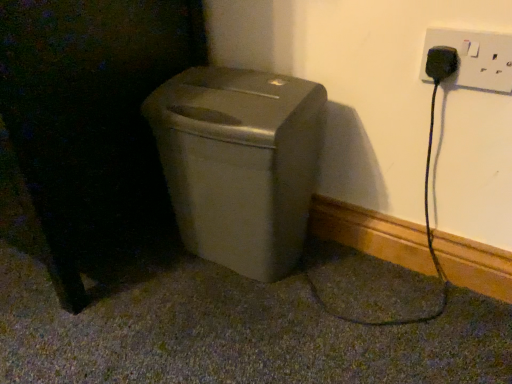
Image resolution: width=512 pixels, height=384 pixels. What do you see at coordinates (240, 163) in the screenshot? I see `satin beige trash can at center` at bounding box center [240, 163].

Image resolution: width=512 pixels, height=384 pixels. What do you see at coordinates (474, 58) in the screenshot?
I see `white plastic plug at upper right` at bounding box center [474, 58].

The width and height of the screenshot is (512, 384). I want to click on satin beige trash can at center, so click(x=240, y=163).

Between point (207, 233) and point (426, 74), which one is positioned behind?

The point (207, 233) is more distant.

Based on the photo, choose the correct answer: Is satin beige trash can at center inside white plastic plug at upper right or outside it?

satin beige trash can at center is outside white plastic plug at upper right.

Which is more to the right, satin beige trash can at center or white plastic plug at upper right?

Positioned to the right is white plastic plug at upper right.

From a real-world perspective, who is located higher, satin beige trash can at center or white plastic plug at upper right?

white plastic plug at upper right.

Is white plastic plug at upper right next to black matte cat at left and touching it?

No, white plastic plug at upper right is not in contact with black matte cat at left.

Does white plastic plug at upper right have a greater width compared to black matte cat at left?

In fact, white plastic plug at upper right might be narrower than black matte cat at left.

Considering the sizes of objects white plastic plug at upper right and black matte cat at left in the image provided, who is shorter, white plastic plug at upper right or black matte cat at left?

white plastic plug at upper right is shorter.

Is white plastic plug at upper right facing towards satin beige trash can at center?

No, white plastic plug at upper right is not oriented towards satin beige trash can at center.

Can you confirm if white plastic plug at upper right is wider than satin beige trash can at center?

Incorrect, the width of white plastic plug at upper right does not surpass that of satin beige trash can at center.

Can you confirm if white plastic plug at upper right is taller than satin beige trash can at center?

In fact, white plastic plug at upper right may be shorter than satin beige trash can at center.

From the image's perspective, which is above, white plastic plug at upper right or satin beige trash can at center?

white plastic plug at upper right is shown above in the image.

Between black matte cat at left and white plastic plug at upper right, which one has larger size?

Bigger between the two is black matte cat at left.

Looking at this image, from the image's perspective, is black matte cat at left under white plastic plug at upper right?

Incorrect, from the image's perspective, black matte cat at left is higher than white plastic plug at upper right.

From a real-world perspective, is black matte cat at left physically located above or below white plastic plug at upper right?

From a real-world perspective, black matte cat at left is physically below white plastic plug at upper right.

Would you consider black matte cat at left to be distant from white plastic plug at upper right?

No, black matte cat at left is in close proximity to white plastic plug at upper right.

Considering the sizes of objects satin beige trash can at center and black matte cat at left in the image provided, who is wider, satin beige trash can at center or black matte cat at left?

black matte cat at left is wider.

Would you say satin beige trash can at center contains black matte cat at left?

No, black matte cat at left is located outside of satin beige trash can at center.

I want to click on dark above the satin beige trash can at center (from the image's perspective), so click(90, 128).

Are black matte cat at left and satin beige trash can at center far apart?

That's not correct — black matte cat at left is a little close to satin beige trash can at center.

In the scene shown: Is the position of black matte cat at left less distant than that of satin beige trash can at center?

Yes, the depth of black matte cat at left is less than that of satin beige trash can at center.

Is satin beige trash can at center at the back of black matte cat at left?

No, satin beige trash can at center is not at the back of black matte cat at left.

From a real-world perspective, relative to satin beige trash can at center, is black matte cat at left vertically above or below?

black matte cat at left is situated higher than satin beige trash can at center in the real world.

At what (x,y) coordinates should I click in order to perform the action: click on waste container below the white plastic plug at upper right (from the image's perspective). Please return your answer as a coordinate pair (x, y). Looking at the image, I should click on (240, 163).

Identify the location of dark lying above the white plastic plug at upper right (from the image's perspective). The height and width of the screenshot is (384, 512). (90, 128).

Estimate the real-world distances between objects in this image. Which object is closer to white plastic plug at upper right, satin beige trash can at center or black matte cat at left?

Based on the image, satin beige trash can at center appears to be nearer to white plastic plug at upper right.

When comparing their distances from black matte cat at left, does satin beige trash can at center or white plastic plug at upper right seem further?

white plastic plug at upper right.

Based on their spatial positions, is white plastic plug at upper right or black matte cat at left closer to satin beige trash can at center?

black matte cat at left is closer to satin beige trash can at center.

Based on their spatial positions, is white plastic plug at upper right or satin beige trash can at center further from black matte cat at left?

white plastic plug at upper right is positioned further to the anchor black matte cat at left.

Estimate the real-world distances between objects in this image. Which object is further from satin beige trash can at center, black matte cat at left or white plastic plug at upper right?

white plastic plug at upper right.

Considering their positions, is black matte cat at left positioned further to white plastic plug at upper right than satin beige trash can at center?

The object further to white plastic plug at upper right is black matte cat at left.

Image resolution: width=512 pixels, height=384 pixels. Find the location of `waste container located between black matte cat at left and white plastic plug at upper right in the left-right direction`. waste container located between black matte cat at left and white plastic plug at upper right in the left-right direction is located at coordinates (240, 163).